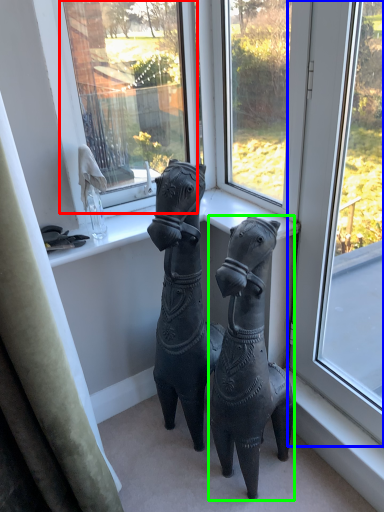
Question: Estimate the real-world distances between objects in this image. Which object is closer to window screen (highlighted by a red box), window (highlighted by a blue box) or horse (highlighted by a green box)?

Choices:
 (A) window
 (B) horse

Answer: (A)